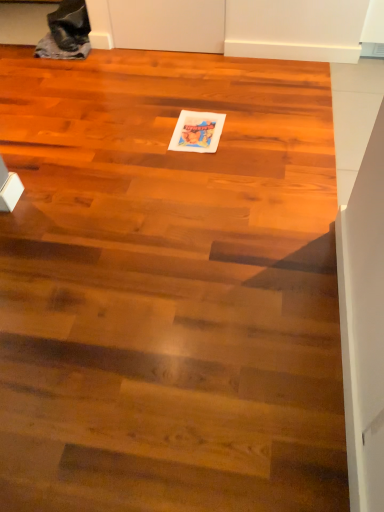
In order to click on vacant location below white paper at center (from a real-world perspective) in this screenshot , I will do `click(197, 131)`.